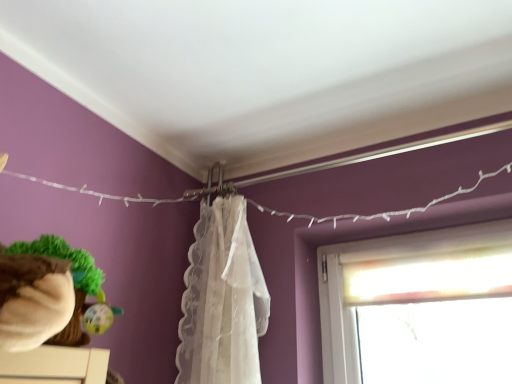
The width and height of the screenshot is (512, 384). What do you see at coordinates (50, 295) in the screenshot? I see `brown plush toy at lower left` at bounding box center [50, 295].

Measure the distance between brown plush toy at lower left and camera.

A distance of 46.53 centimeters exists between brown plush toy at lower left and camera.

This screenshot has height=384, width=512. In order to click on brown plush toy at lower left in this screenshot , I will do `click(50, 295)`.

The height and width of the screenshot is (384, 512). Identify the location of brown plush toy at lower left. point(50,295).